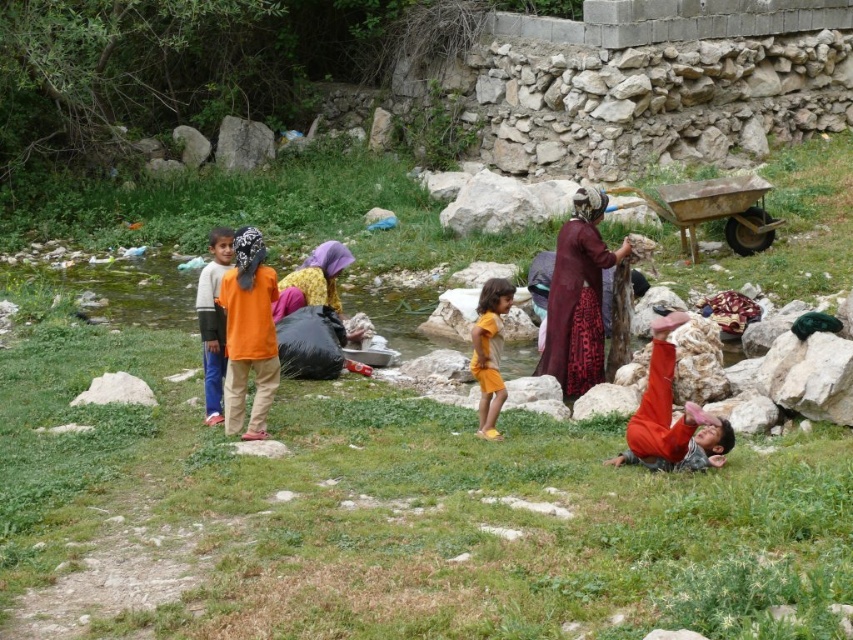
Does maroon fabric dress at center lie behind orange fabric headscarf at center?

No, it is in front of orange fabric headscarf at center.

Does maroon fabric dress at center have a greater height compared to orange fabric headscarf at center?

Correct, maroon fabric dress at center is much taller as orange fabric headscarf at center.

What do you see at coordinates (578, 298) in the screenshot?
I see `maroon fabric dress at center` at bounding box center [578, 298].

This screenshot has width=853, height=640. I want to click on maroon fabric dress at center, so click(x=578, y=298).

Who is lower down, orange cotton shirt at lower right or orange cotton shirt at left?

orange cotton shirt at lower right is below.

Measure the distance between orange cotton shirt at lower right and camera.

The distance of orange cotton shirt at lower right from camera is 29.25 feet.

Is point (705, 432) more distant than point (212, 292)?

No, it is in front of (212, 292).

The image size is (853, 640). I want to click on orange cotton shirt at lower right, so click(670, 417).

Can you confirm if orange cotton shirt at center is positioned below orange cotton shirt at lower right?

Incorrect, orange cotton shirt at center is not positioned below orange cotton shirt at lower right.

Does orange cotton shirt at center have a smaller size compared to orange cotton shirt at lower right?

Indeed, orange cotton shirt at center has a smaller size compared to orange cotton shirt at lower right.

What do you see at coordinates (248, 333) in the screenshot? I see `orange cotton shirt at center` at bounding box center [248, 333].

You are a GUI agent. You are given a task and a screenshot of the screen. Output one action in this format:
    pyautogui.click(x=<x>, y=<y>)
    Task: Click on the orange cotton shirt at center
    The width and height of the screenshot is (853, 640).
    Given the screenshot: What is the action you would take?
    pyautogui.click(x=248, y=333)